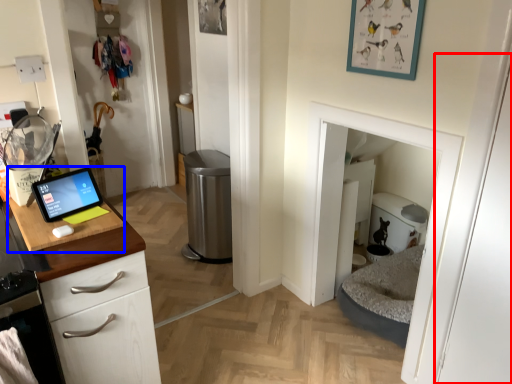
Question: Which of the following is the closest to the observer, door (highlighted by a red box) or sink (highlighted by a blue box)?

Choices:
 (A) door
 (B) sink

Answer: (A)